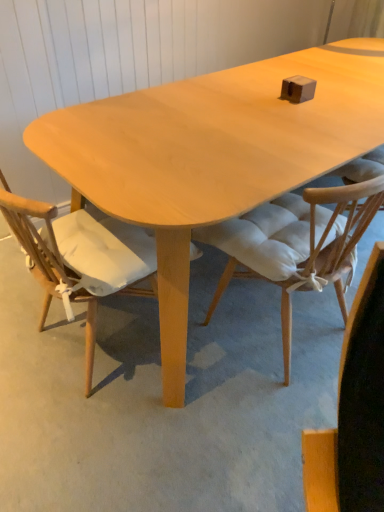
At what (x,y) coordinates should I click in order to perform the action: click on vacant area that lies in front of light wood chair at center, the 1th chair from the left. Please return your answer as a coordinate pair (x, y). Looking at the image, I should click on (110, 438).